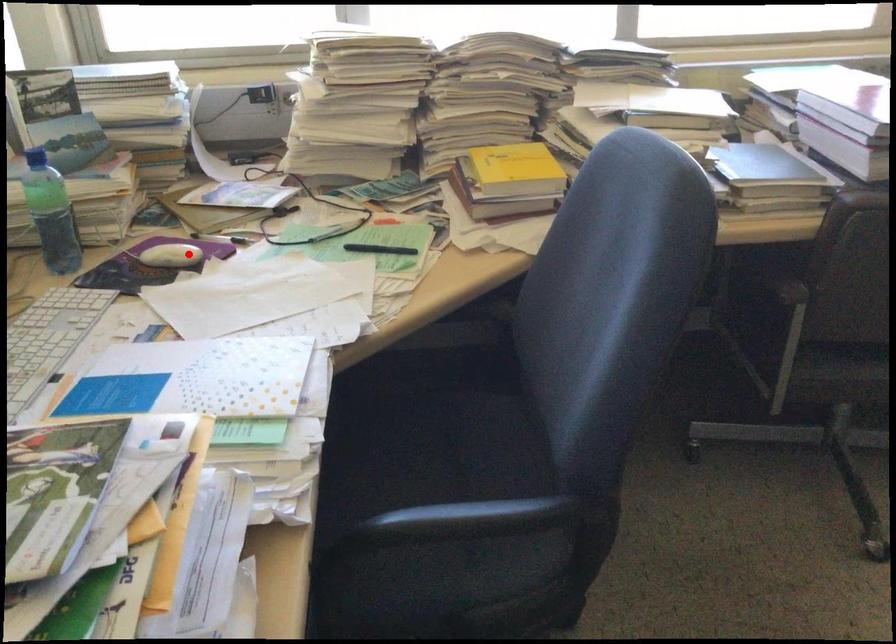
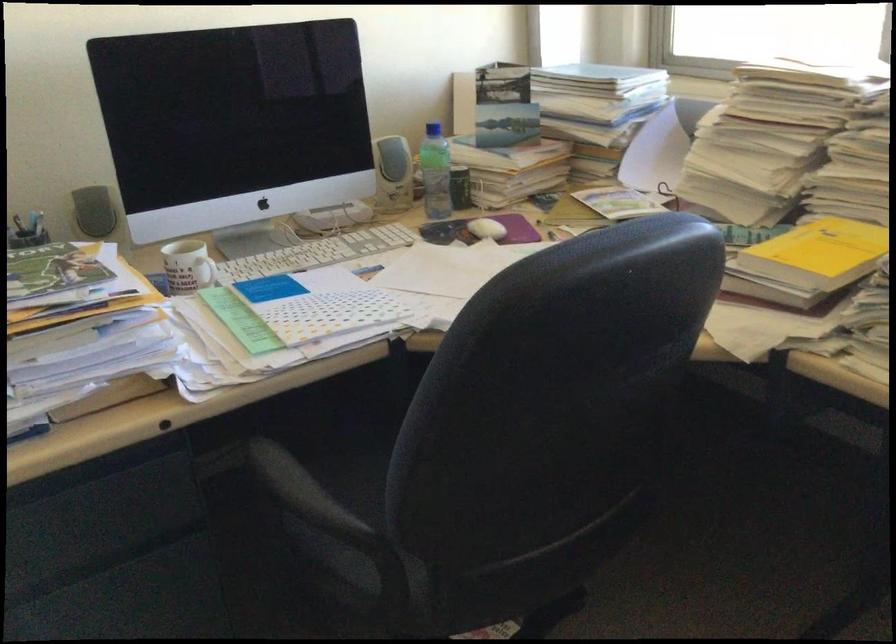
Locate, in the second image, the point that corresponds to the highlighted location in the first image.

(487, 229)